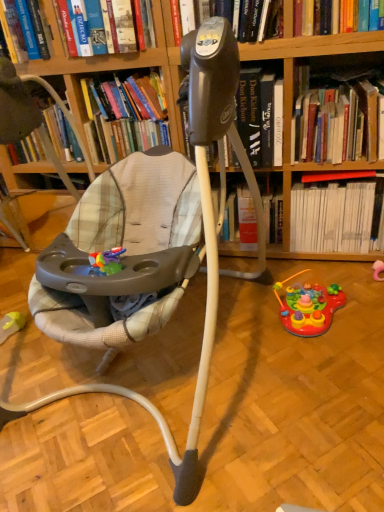
Locate an element on the screen. Image resolution: width=384 pixels, height=512 pixels. free location to the right of rubber yellow toy at lower left, which is the 3th toy from right to left is located at coordinates (44, 346).